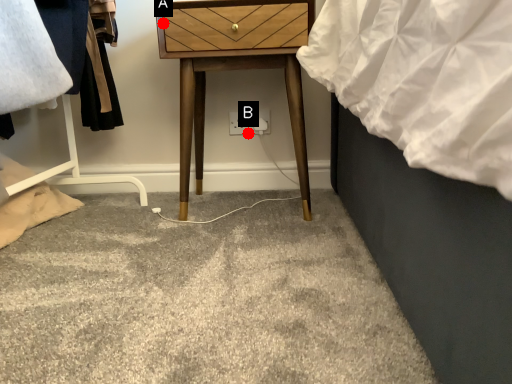
Question: Two points are circled on the image, labeled by A and B beside each circle. Which point is farther to the camera?

Choices:
 (A) A is further
 (B) B is further

Answer: (B)